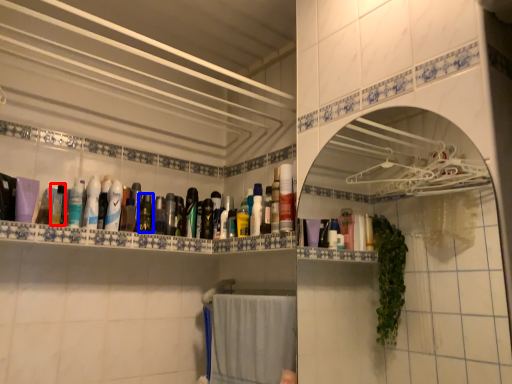
Question: Which point is further to the camera, mouthwash (highlighted by a red box) or mouthwash (highlighted by a blue box)?

Choices:
 (A) mouthwash
 (B) mouthwash

Answer: (B)